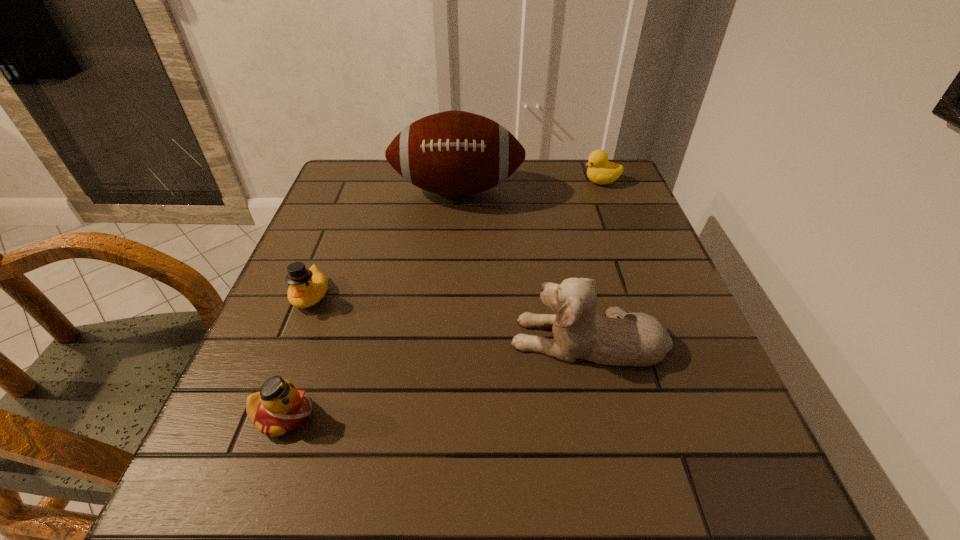
This screenshot has width=960, height=540. Find the location of `blank region between the fourth shortest object and the second farthest duck`. blank region between the fourth shortest object and the second farthest duck is located at coordinates (450, 317).

Locate an element on the screen. This screenshot has height=540, width=960. free space between the fourth shortest object and the second farthest duck is located at coordinates (450, 317).

Where is `free spot between the second farthest duck and the farthest duck`? The width and height of the screenshot is (960, 540). free spot between the second farthest duck and the farthest duck is located at coordinates (456, 238).

Identify the location of vacant region between the nearest object and the second farthest duck. (298, 355).

Locate an element on the screen. This screenshot has width=960, height=540. empty space that is in between the nearest duck and the football is located at coordinates (371, 303).

Identify the location of free space between the nearest object and the second nearest duck. (298, 355).

Point out which object is positioned as the second nearest to the fourth shortest object. Please provide its 2D coordinates. Your answer should be formatted as a tuple, i.e. [(x, y)], where the tuple contains the x and y coordinates of a point satisfying the conditions above.

[(454, 153)]

Choose which object is the third nearest neighbor to the nearest object. Please provide its 2D coordinates. Your answer should be formatted as a tuple, i.e. [(x, y)], where the tuple contains the x and y coordinates of a point satisfying the conditions above.

[(454, 153)]

Identify which duck is the third nearest to the puppy. Please provide its 2D coordinates. Your answer should be formatted as a tuple, i.e. [(x, y)], where the tuple contains the x and y coordinates of a point satisfying the conditions above.

[(601, 171)]

Point out which duck is positioned as the nearest to the nearest object. Please provide its 2D coordinates. Your answer should be formatted as a tuple, i.e. [(x, y)], where the tuple contains the x and y coordinates of a point satisfying the conditions above.

[(307, 287)]